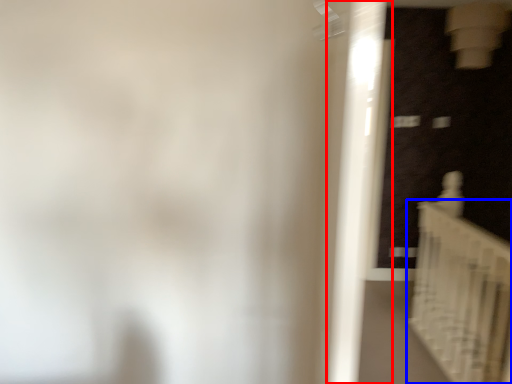
Question: Among these objects, which one is farthest to the camera, door (highlighted by a red box) or stairs (highlighted by a blue box)?

Choices:
 (A) door
 (B) stairs

Answer: (B)